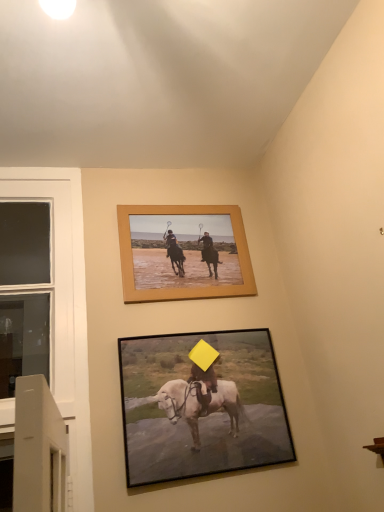
Question: Considering the positions of point (165, 406) and point (44, 331), is point (165, 406) closer or farther from the camera than point (44, 331)?

Choices:
 (A) closer
 (B) farther

Answer: (A)

Question: In terms of width, does black matte picture frame at lower center, which is the first picture frame in bottom-to-top order, look wider or thinner when compared to white glass window at left?

Choices:
 (A) wide
 (B) thin

Answer: (B)

Question: Which is nearer to the black matte picture frame at lower center, the second picture frame positioned from the top?

Choices:
 (A) wooden frame at upper center, the first picture frame positioned from the top
 (B) white glass window at left

Answer: (A)

Question: Estimate the real-world distances between objects in this image. Which object is closer to the black matte picture frame at lower center, which is the first picture frame in bottom-to-top order?

Choices:
 (A) white glass window at left
 (B) wooden frame at upper center, arranged as the second picture frame when ordered from the bottom

Answer: (B)